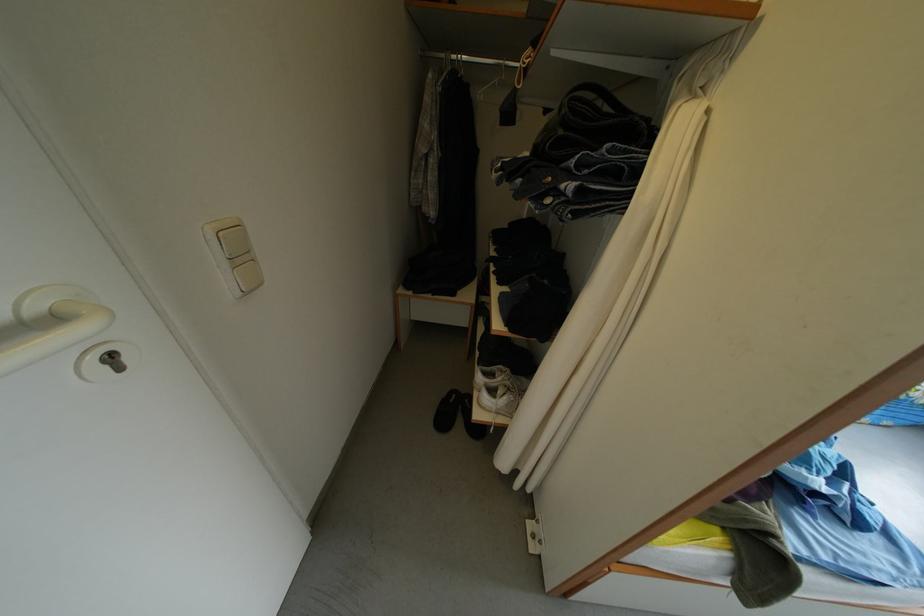
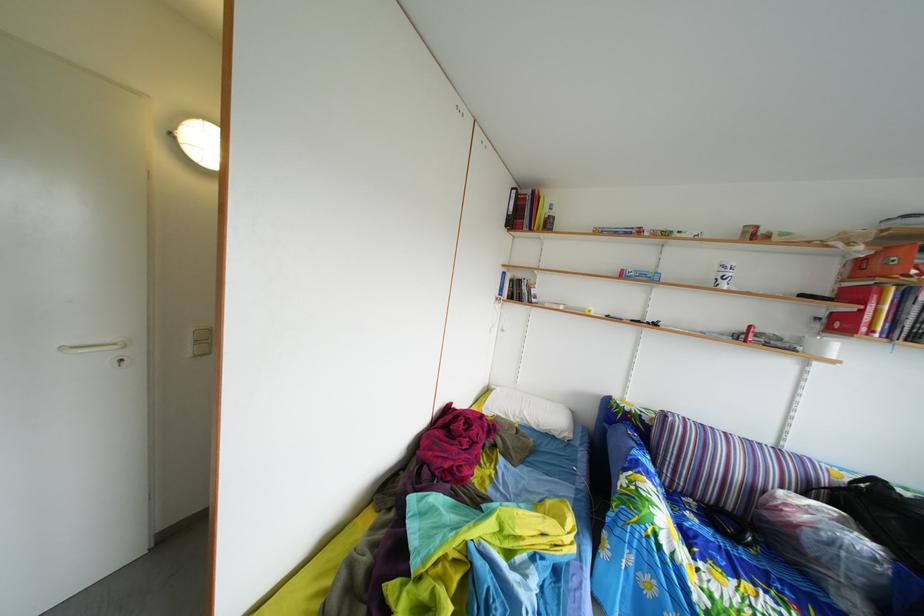
Question: I am providing you with two images of the same scene from different viewpoints. After the viewpoint changes to image2, which objects are now occluded?

Choices:
 (A) black slipper
 (B) white pillow
 (C) dark tufted pillow
 (D) black bag

Answer: (A)